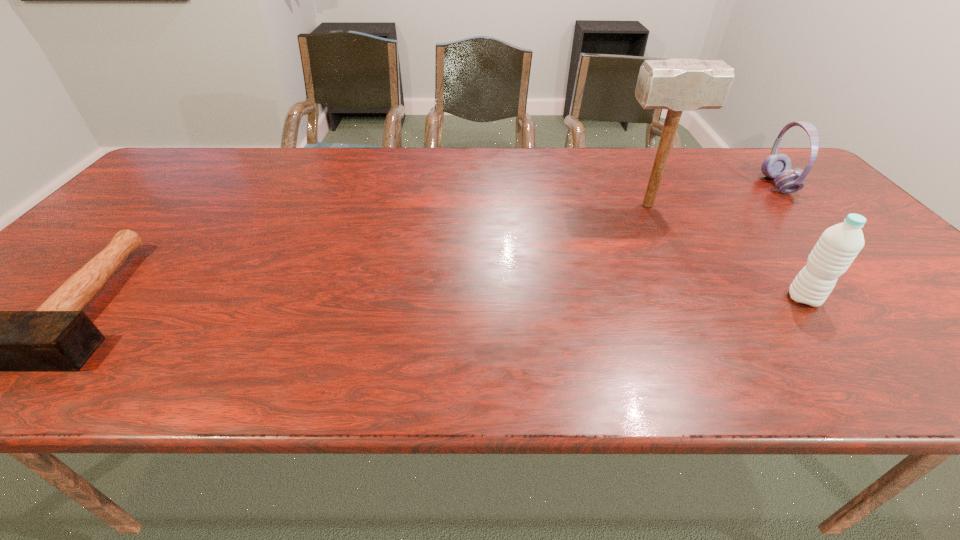
Where is `blank region between the taller mallet and the second object from right to left`? blank region between the taller mallet and the second object from right to left is located at coordinates (726, 252).

Identify which object is the third nearest to the second object from right to left. Please provide its 2D coordinates. Your answer should be formatted as a tuple, i.e. [(x, y)], where the tuple contains the x and y coordinates of a point satisfying the conditions above.

[(58, 336)]

Locate which object is the closest to the third object from right to left. Please provide its 2D coordinates. Your answer should be formatted as a tuple, i.e. [(x, y)], where the tuple contains the x and y coordinates of a point satisfying the conditions above.

[(777, 166)]

Where is `free space that satisfies the following two spatial constraints: 1. on the striking face of the second object from right to left; 2. on the left side of the tallest object`? This screenshot has height=540, width=960. free space that satisfies the following two spatial constraints: 1. on the striking face of the second object from right to left; 2. on the left side of the tallest object is located at coordinates (696, 299).